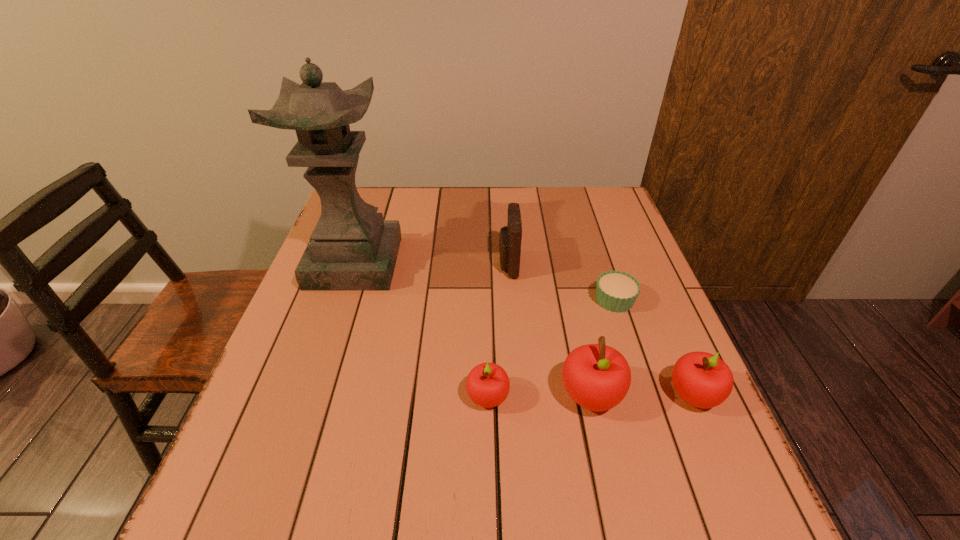
I want to click on vacant position in the image that satisfies the following two spatial constraints: 1. with an open flap on the pouch; 2. on the left side of the shortest object, so click(x=511, y=300).

I want to click on vacant space that satisfies the following two spatial constraints: 1. with an open flap on the pouch; 2. on the back side of the second tallest apple, so click(517, 395).

Image resolution: width=960 pixels, height=540 pixels. I want to click on vacant position in the image that satisfies the following two spatial constraints: 1. at the front opening of the sculpture; 2. on the left side of the second apple from left to right, so click(x=309, y=396).

Locate an element on the screen. free space that satisfies the following two spatial constraints: 1. with an open flap on the cupcake; 2. on the left side of the pouch is located at coordinates (511, 300).

This screenshot has height=540, width=960. Identify the location of vacant space that satisfies the following two spatial constraints: 1. with an open flap on the tallest apple; 2. on the right side of the pouch. (517, 396).